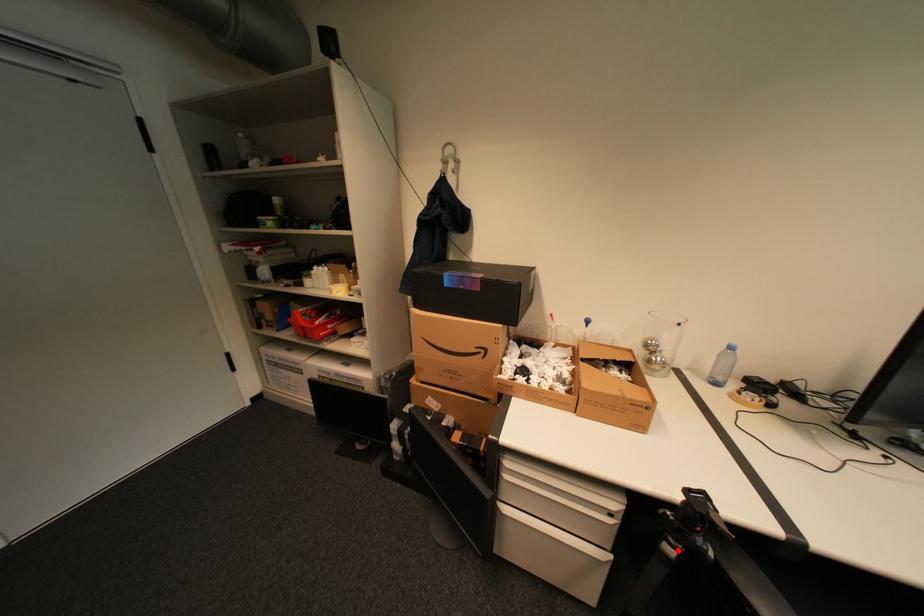
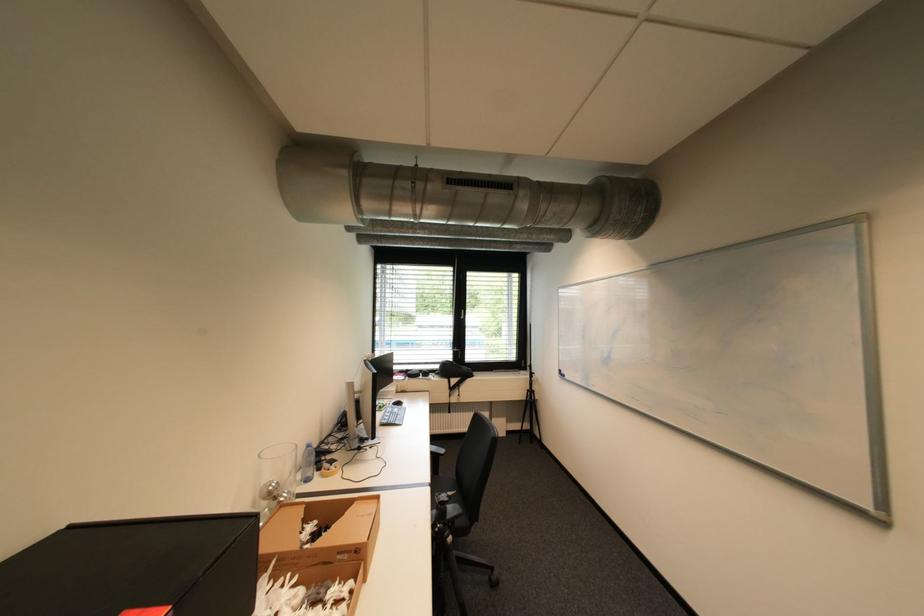
Find the pixel in the second image that matches the highlighted location in the first image.

(458, 540)